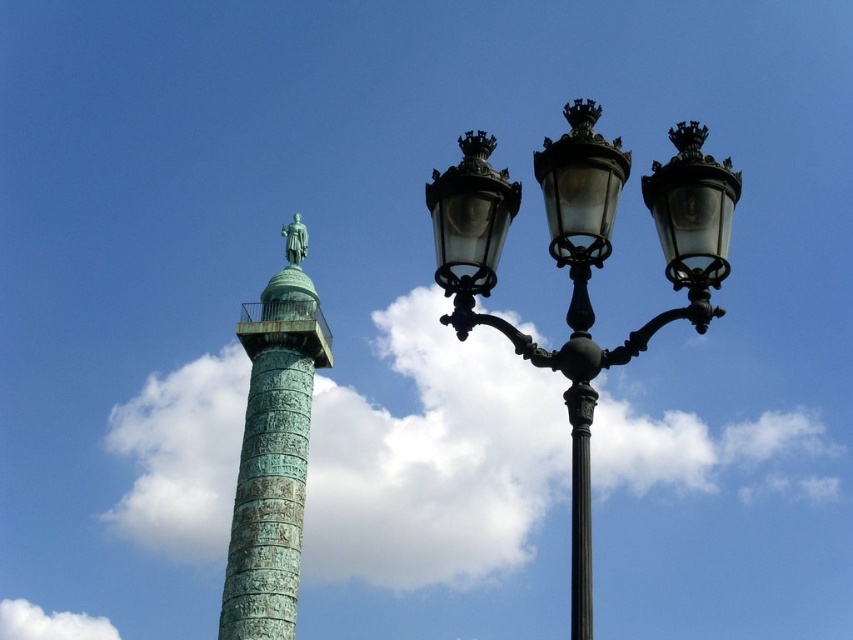
You are standing in front of the architectural scene. There are two points marked in the image, one at coordinate point (671, 164) and another at point (50, 628). Which point is nearer to your viewpoint?

Point (671, 164) is closer to the camera than point (50, 628).

You are an architect assessing the proportions of the scene. Given the green patina glass streetlight at center and the white fluffy cloud at lower left, which object is taller?

The white fluffy cloud at lower left is taller than the green patina glass streetlight at center.